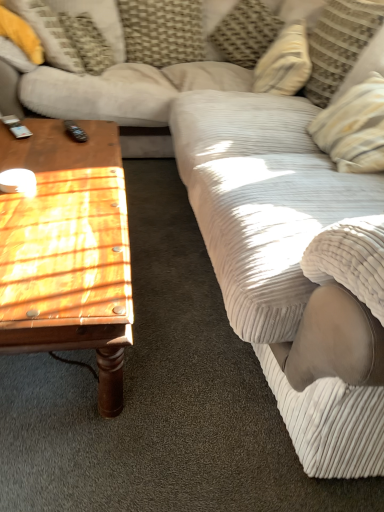
Question: In terms of size, does wooden polished coffee table at left appear bigger or smaller than yellow fabric pillow at upper left, the first pillow when ordered from left to right?

Choices:
 (A) big
 (B) small

Answer: (A)

Question: Considering the positions of wooden polished coffee table at left and yellow fabric pillow at upper left, the first pillow when ordered from left to right, in the image, is wooden polished coffee table at left taller or shorter than yellow fabric pillow at upper left, the first pillow when ordered from left to right,?

Choices:
 (A) tall
 (B) short

Answer: (A)

Question: Considering the real-world distances, which object is closest to the woven fabric pillow at upper center, the third pillow positioned from the right?

Choices:
 (A) textured beige pillow at upper center, arranged as the 2th pillow when viewed from the right
 (B) black plastic remote at left
 (C) yellow fabric pillow at upper left, which is counted as the fourth pillow, starting from the right
 (D) striped fabric pillow at upper right, arranged as the first pillow when viewed from the right
 (E) wooden polished coffee table at left

Answer: (A)

Question: Estimate the real-world distances between objects in this image. Which object is closer to the yellow fabric pillow at upper left, which is counted as the fourth pillow, starting from the right?

Choices:
 (A) striped fabric pillow at upper right, the fourth pillow from the left
 (B) textured beige pillow at upper center, acting as the 3th pillow starting from the left
 (C) wooden polished coffee table at left
 (D) woven fabric pillow at upper center, the third pillow positioned from the right
 (E) black plastic remote at left

Answer: (E)